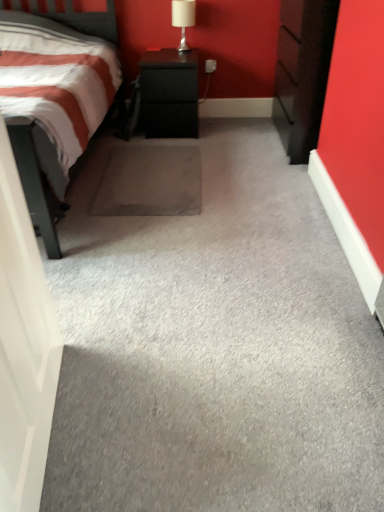
Identify the location of vacant space behind white glossy door at left. (110, 333).